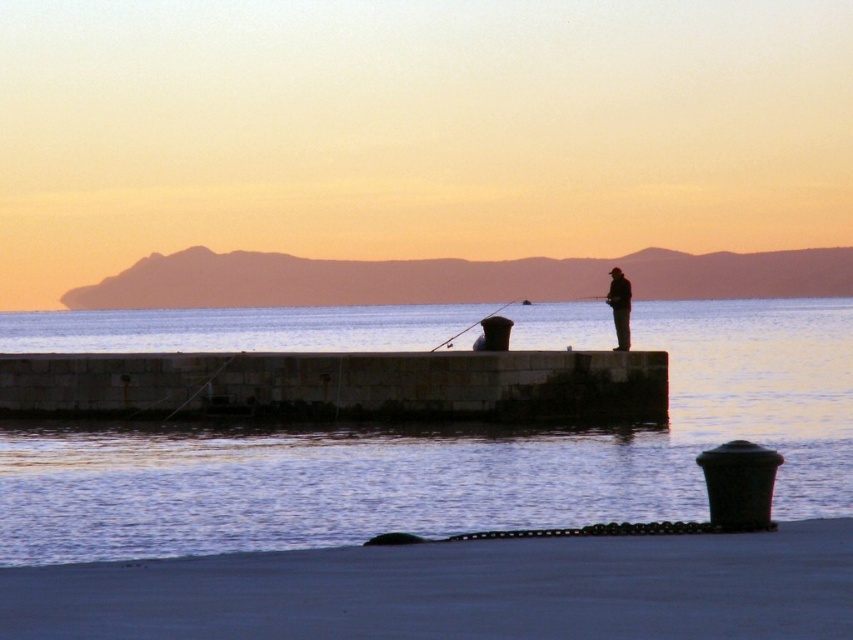
Question: Which of these objects is positioned closest to the stone concrete pier at center?

Choices:
 (A) silhouette figure at center
 (B) smooth concrete pier at lower center
 (C) smooth water at center

Answer: (A)

Question: Is smooth water at center in front of smooth concrete pier at lower center?

Choices:
 (A) no
 (B) yes

Answer: (A)

Question: Which of the following is the closest to the observer?

Choices:
 (A) (207, 387)
 (B) (112, 589)
 (C) (212, 460)

Answer: (B)

Question: Considering the real-world distances, which object is closest to the smooth concrete pier at lower center?

Choices:
 (A) stone concrete pier at center
 (B) silhouette figure at center

Answer: (A)

Question: Does smooth concrete pier at lower center have a lesser width compared to silhouette figure at center?

Choices:
 (A) yes
 (B) no

Answer: (B)

Question: Is smooth water at center bigger than stone concrete pier at center?

Choices:
 (A) no
 (B) yes

Answer: (B)